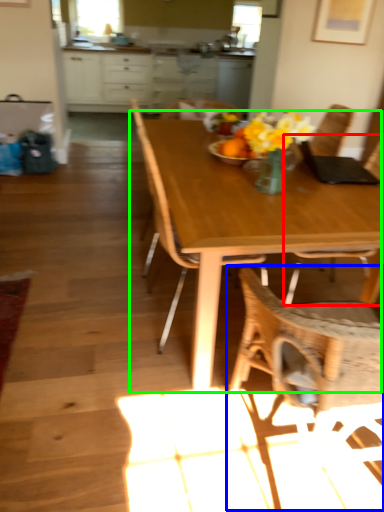
Question: Considering the real-world distances, which object is farthest from chair (highlighted by a red box)? chair (highlighted by a blue box) or kitchen & dining room table (highlighted by a green box)?

Choices:
 (A) chair
 (B) kitchen & dining room table

Answer: (B)